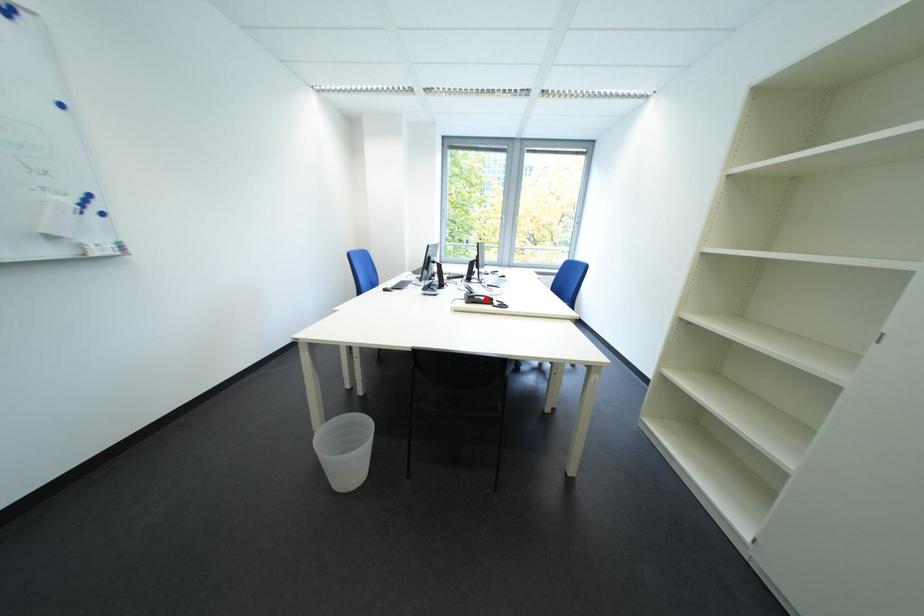
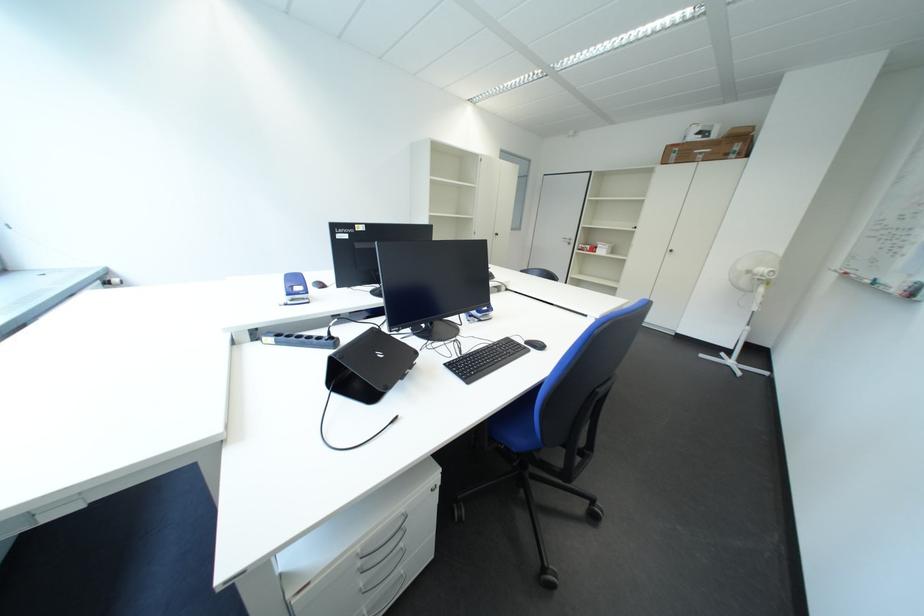
Question: I am providing you with two images of the same scene from different viewpoints. A red point is marked on the first image. At the location where the point appears in image 1, is it still visible in image 2?

Choices:
 (A) Yes
 (B) No

Answer: (B)